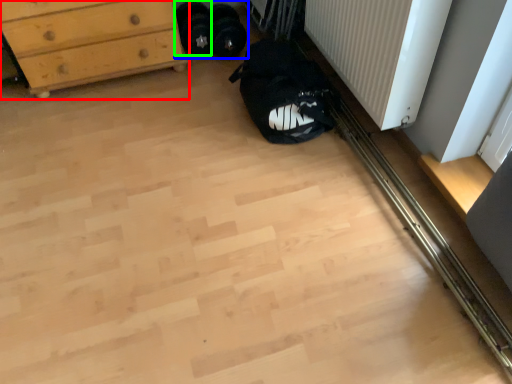
Question: Which object is positioned closest to chest of drawers (highlighted by a red box)? Select from footwear (highlighted by a blue box) and footwear (highlighted by a green box).

Choices:
 (A) footwear
 (B) footwear

Answer: (A)